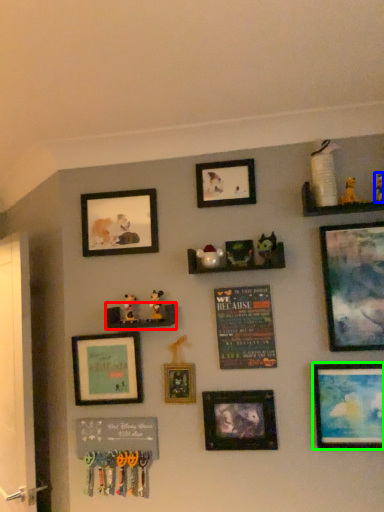
Question: Which is farther away from shelf (highlighted by a red box)? toy (highlighted by a blue box) or picture frame (highlighted by a green box)?

Choices:
 (A) toy
 (B) picture frame

Answer: (A)